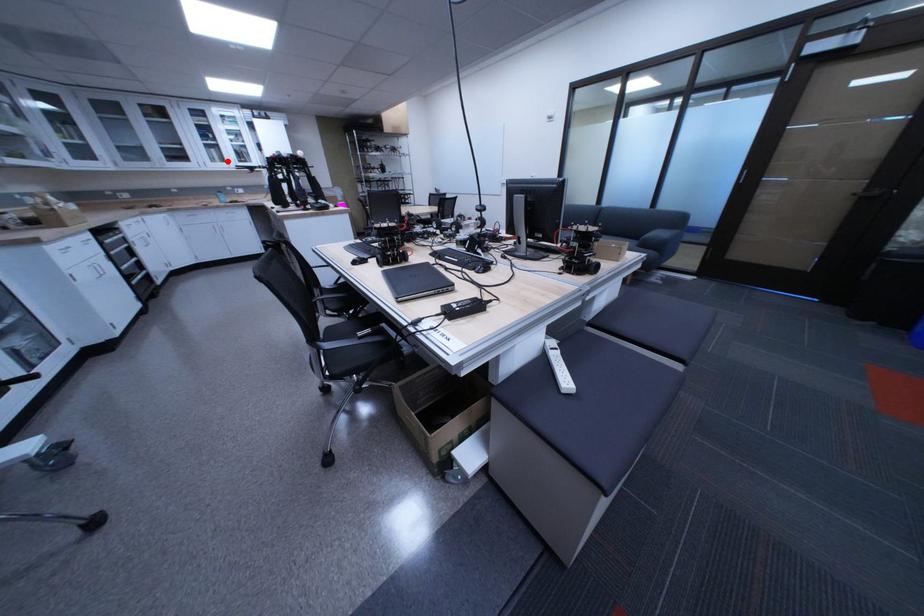
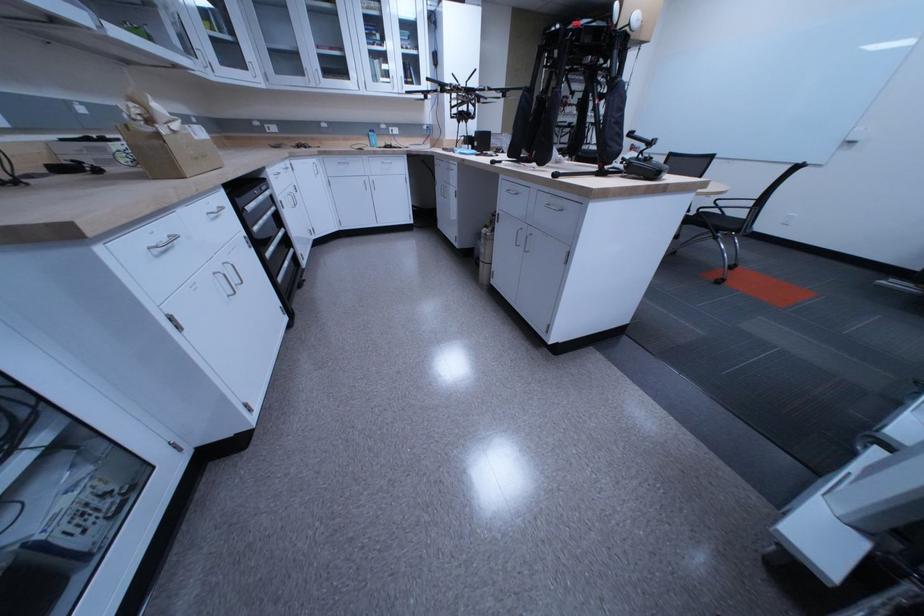
Where in the second image is the point corresponding to the highlighted location from the first image?

(390, 79)